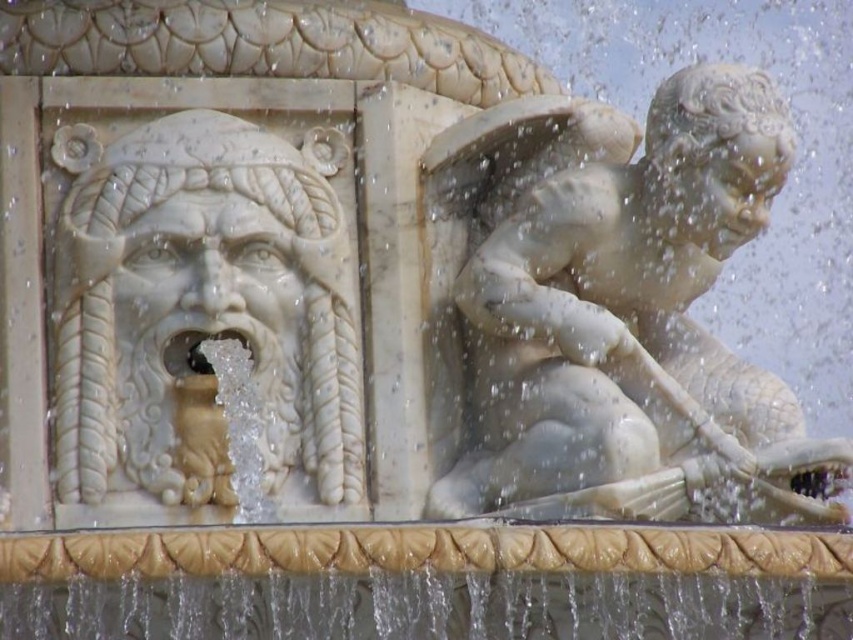
Which of these two, white marble statue at right or white marble face at left, stands taller?

With more height is white marble statue at right.

Is point (498, 296) closer to camera compared to point (263, 356)?

No, (498, 296) is further to viewer.

In order to click on white marble statue at right in this screenshot , I will do `click(625, 316)`.